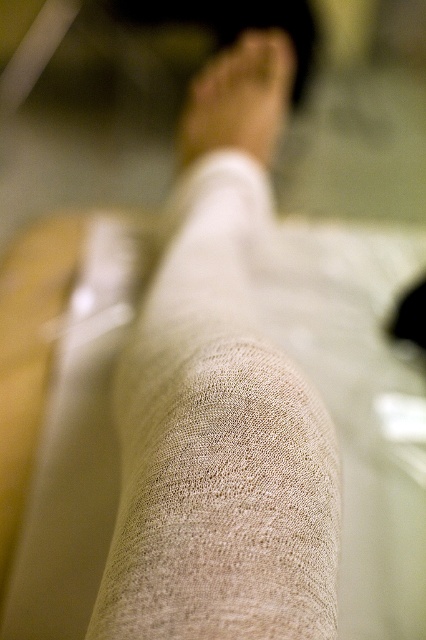
Is point (178, 582) farther from camera compared to point (192, 109)?

No, (178, 582) is closer to viewer.

What do you see at coordinates (218, 445) in the screenshot? The width and height of the screenshot is (426, 640). I see `beige knitted leg at center` at bounding box center [218, 445].

Identify the location of beige knitted leg at center. The width and height of the screenshot is (426, 640). (218, 445).